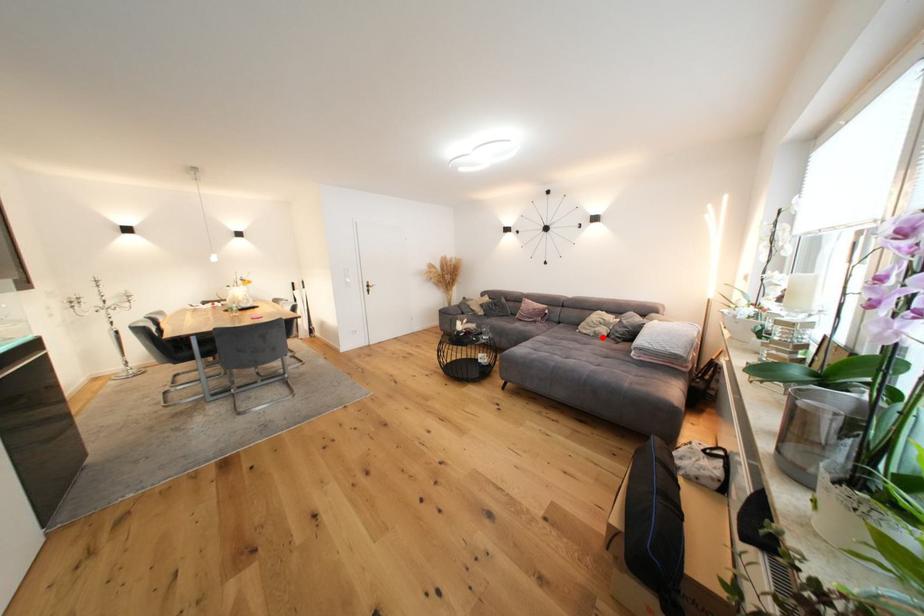
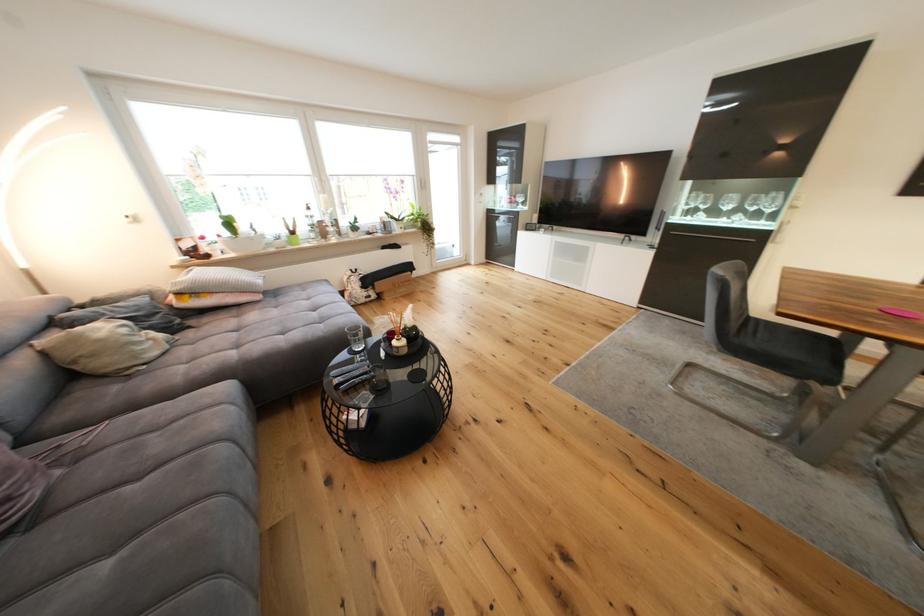
In the second image, find the point that corresponds to the highlighted location in the first image.

(178, 345)